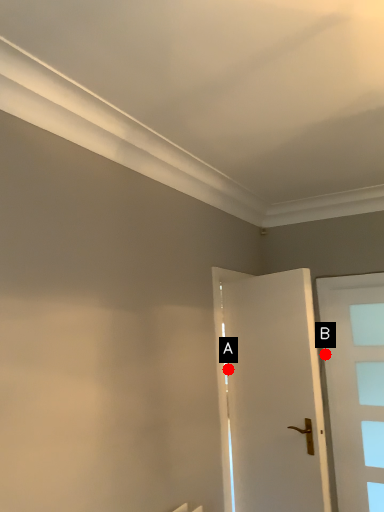
Question: Two points are circled on the image, labeled by A and B beside each circle. Which point appears farthest from the camera in this image?

Choices:
 (A) A is further
 (B) B is further

Answer: (B)